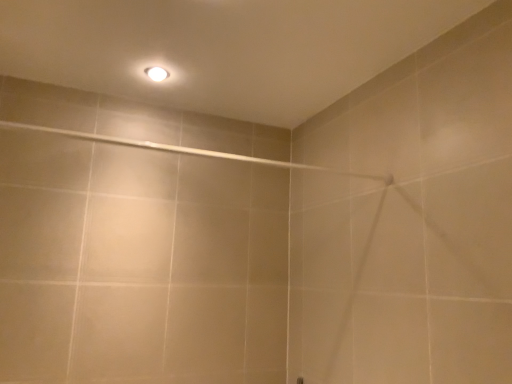
Question: In terms of size, does white glossy light bulb at upper center appear bigger or smaller than beige ceramic shower at upper center?

Choices:
 (A) big
 (B) small

Answer: (B)

Question: From the image's perspective, is white glossy light bulb at upper center located above or below beige ceramic shower at upper center?

Choices:
 (A) below
 (B) above

Answer: (B)

Question: Is white glossy light bulb at upper center taller or shorter than beige ceramic shower at upper center?

Choices:
 (A) short
 (B) tall

Answer: (A)

Question: From the image's perspective, relative to white glossy light bulb at upper center, is beige ceramic shower at upper center above or below?

Choices:
 (A) above
 (B) below

Answer: (B)

Question: From a real-world perspective, relative to white glossy light bulb at upper center, is beige ceramic shower at upper center vertically above or below?

Choices:
 (A) above
 (B) below

Answer: (B)

Question: Based on their positions, is beige ceramic shower at upper center located to the left or right of white glossy light bulb at upper center?

Choices:
 (A) left
 (B) right

Answer: (B)

Question: Considering the positions of point (275, 165) and point (163, 71), is point (275, 165) closer or farther from the camera than point (163, 71)?

Choices:
 (A) closer
 (B) farther

Answer: (A)